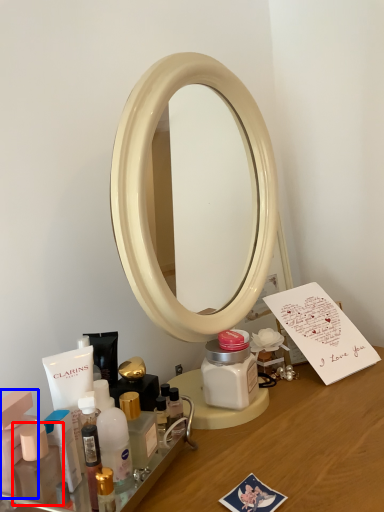
Question: Which point is closer to the camera, toiletry (highlighted by a red box) or toiletry (highlighted by a blue box)?

Choices:
 (A) toiletry
 (B) toiletry

Answer: (A)